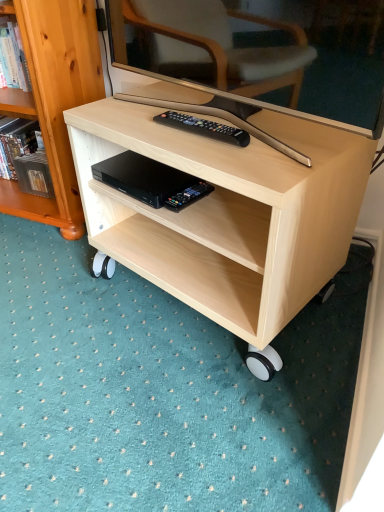
This screenshot has width=384, height=512. Identify the location of free space in front of black plastic remote at center. (224, 158).